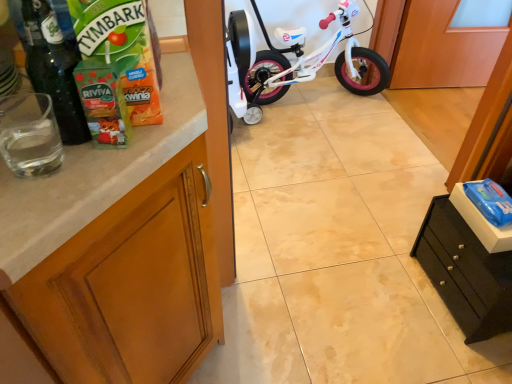
Locate an element on the screen. free space underneath white glossy bicycle at center (from a real-world perspective) is located at coordinates (321, 103).